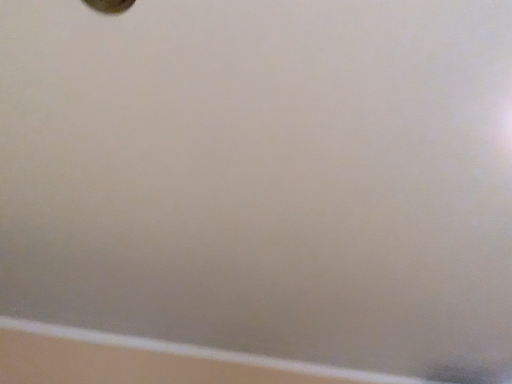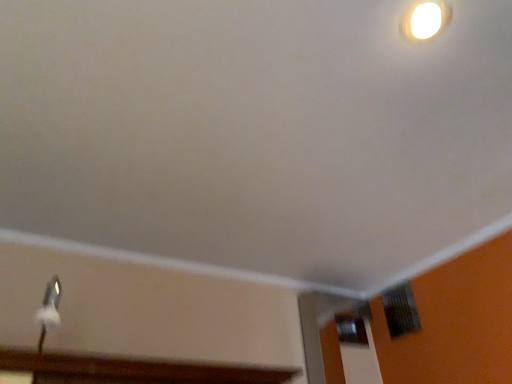
Question: How did the camera likely rotate when shooting the video?

Choices:
 (A) rotated upward
 (B) rotated downward

Answer: (B)